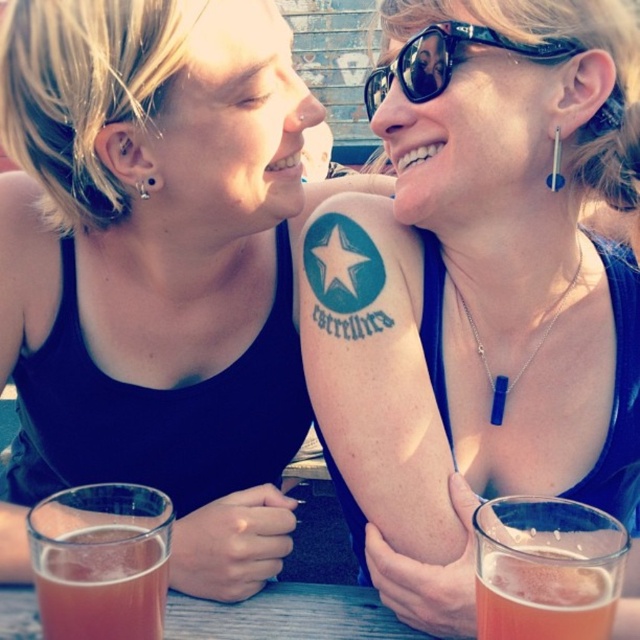
Between matte black tank top at upper center and translucent glass at lower right, which one appears on the left side from the viewer's perspective?

From the viewer's perspective, matte black tank top at upper center appears more on the left side.

Which is more to the right, matte black tank top at upper center or translucent glass at lower right?

translucent glass at lower right is more to the right.

Is point (436, 77) behind point (497, 632)?

That is True.

The height and width of the screenshot is (640, 640). Identify the location of matte black tank top at upper center. (477, 292).

This screenshot has height=640, width=640. Describe the element at coordinates (477, 292) in the screenshot. I see `matte black tank top at upper center` at that location.

Is matte black tank top at upper center positioned behind matte black tank top at upper left?

That is False.

Is point (486, 193) closer to camera compared to point (33, 156)?

That is False.

Identify the location of matte black tank top at upper center. The height and width of the screenshot is (640, 640). (477, 292).

Between matte black tank top at upper left and black plastic sunglasses at upper right, which one appears on the right side from the viewer's perspective?

From the viewer's perspective, black plastic sunglasses at upper right appears more on the right side.

Can you confirm if matte black tank top at upper left is shorter than black plastic sunglasses at upper right?

Yes, matte black tank top at upper left is shorter than black plastic sunglasses at upper right.

In order to click on matte black tank top at upper left in this screenshot , I will do `click(150, 179)`.